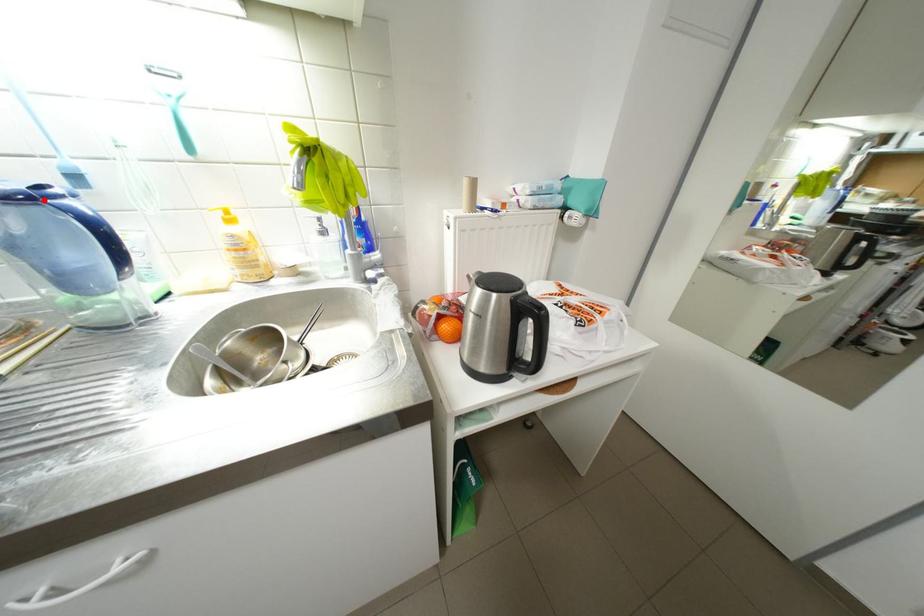
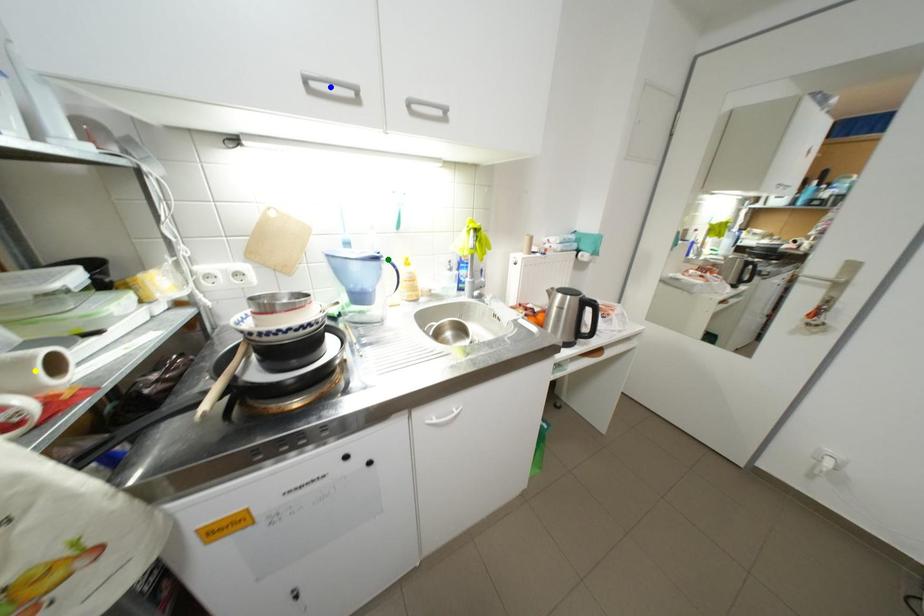
Question: I am providing you with two images of the same scene from different viewpoints. A red point is marked on the first image. You are given multiple points on the second image. Which point in image 2 is actually the same real-world point as the red point in image 1?

Choices:
 (A) yellow point
 (B) green point
 (C) blue point

Answer: (B)